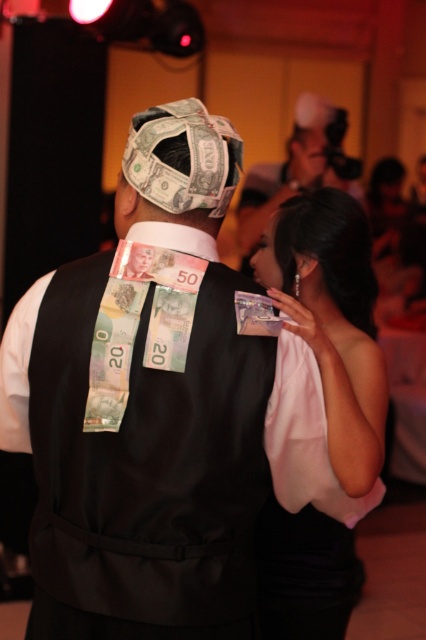
Question: Is black fabric vest at back to the left of pink satin scarf at upper right from the viewer's perspective?

Choices:
 (A) yes
 (B) no

Answer: (A)

Question: In this image, where is smooth plastic id card at upper center located relative to smooth skin head at upper right?

Choices:
 (A) below
 (B) above

Answer: (A)

Question: Which object is positioned closest to the black satin hair at upper center?

Choices:
 (A) black fabric vest at back
 (B) smooth skin head at upper right
 (C) crinkled paper money at center
 (D) pink satin scarf at upper right

Answer: (D)

Question: Is black satin hair at upper center below smooth plastic id card at upper center?

Choices:
 (A) no
 (B) yes

Answer: (A)

Question: Based on their relative distances, which object is nearer to the matte white hat at upper center?

Choices:
 (A) pink satin scarf at upper right
 (B) smooth skin head at upper right

Answer: (B)

Question: Considering the real-world distances, which object is closest to the crinkled paper money at center?

Choices:
 (A) smooth plastic id card at upper center
 (B) black satin hair at upper center

Answer: (A)